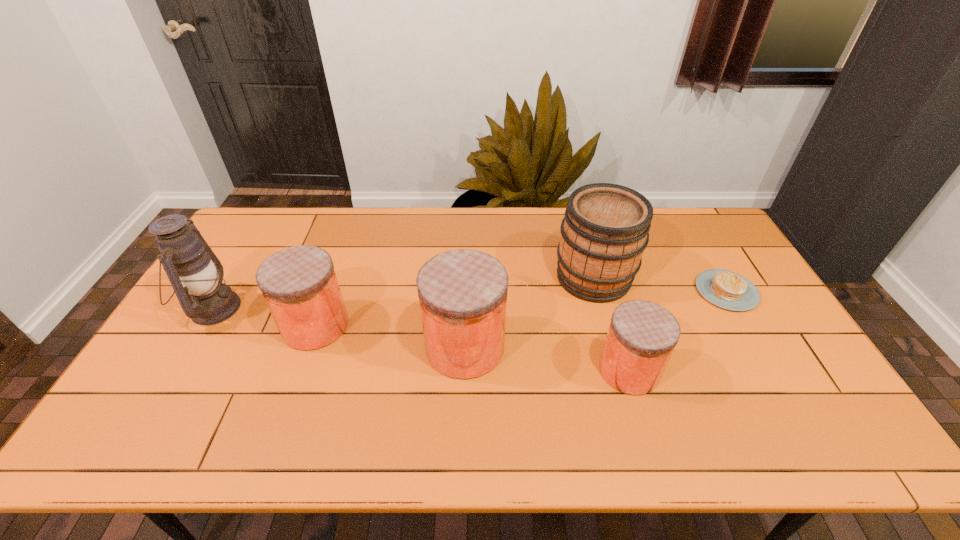
Identify the location of vacant area situated 0.330m on the right of the fourth object from right to left. This screenshot has height=540, width=960. (625, 347).

At what (x,y) coordinates should I click in order to perform the action: click on vacant space located on the left of the fifth tallest object. Please return your answer as a coordinate pair (x, y). This screenshot has width=960, height=540. Looking at the image, I should click on (576, 370).

Locate an element on the screen. The height and width of the screenshot is (540, 960). free space located 0.280m on the left of the cider is located at coordinates (467, 277).

Identify the location of vacant region located on the left of the rightmost object. (638, 291).

At what (x,y) coordinates should I click in order to perform the action: click on vacant position located 0.370m on the back of the leftmost object. Please return your answer as a coordinate pair (x, y). This screenshot has width=960, height=540. Looking at the image, I should click on pyautogui.click(x=269, y=216).

Identify the location of object located at the left edge. (196, 274).

The image size is (960, 540). Find the location of `object that is at the right edge`. object that is at the right edge is located at coordinates (726, 289).

At what (x,y) coordinates should I click in order to perform the action: click on free space at the far edge of the desktop. Please return your answer as a coordinate pair (x, y). Looking at the image, I should click on (302, 240).

Locate an element on the screen. free space at the near edge of the desktop is located at coordinates (260, 405).

What are the coordinates of `free space at the left edge` in the screenshot? It's located at (221, 262).